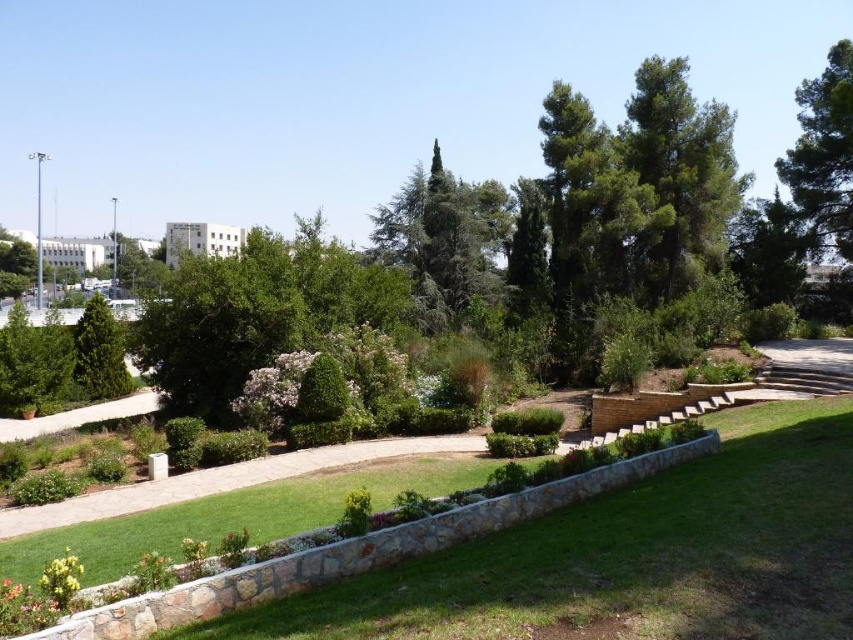
Does green needle-like at upper center have a smaller size compared to green leafy tree at upper right?

Indeed, green needle-like at upper center has a smaller size compared to green leafy tree at upper right.

Between point (711, 141) and point (839, 177), which one is positioned behind?

The point (839, 177) is more distant.

Is point (712, 164) closer to camera compared to point (821, 125)?

Yes, it is.

Find the location of a particular element. The image size is (853, 640). green needle-like at upper center is located at coordinates (676, 180).

Can you confirm if green grass at center is positioned to the left of green leafy bush at center-left?

In fact, green grass at center is to the right of green leafy bush at center-left.

Which is in front, point (291, 636) or point (117, 384)?

Point (291, 636)

Does point (695, 608) lie in front of point (94, 321)?

Yes, it is.

Identify the location of green grass at center. tap(628, 556).

Between point (630, 268) and point (100, 317), which one is positioned behind?

Positioned behind is point (630, 268).

Does green needle-like at upper center have a greater width compared to green leafy bush at center-left?

Indeed, green needle-like at upper center has a greater width compared to green leafy bush at center-left.

Which is behind, point (669, 168) or point (108, 326)?

The point (669, 168) is behind.

Identify the location of green needle-like at upper center. Image resolution: width=853 pixels, height=640 pixels. (676, 180).